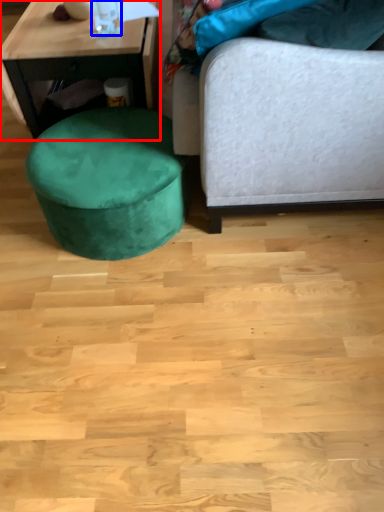
Question: Which of the following is the farthest to the observer, table (highlighted by a red box) or bottle (highlighted by a blue box)?

Choices:
 (A) table
 (B) bottle

Answer: (A)